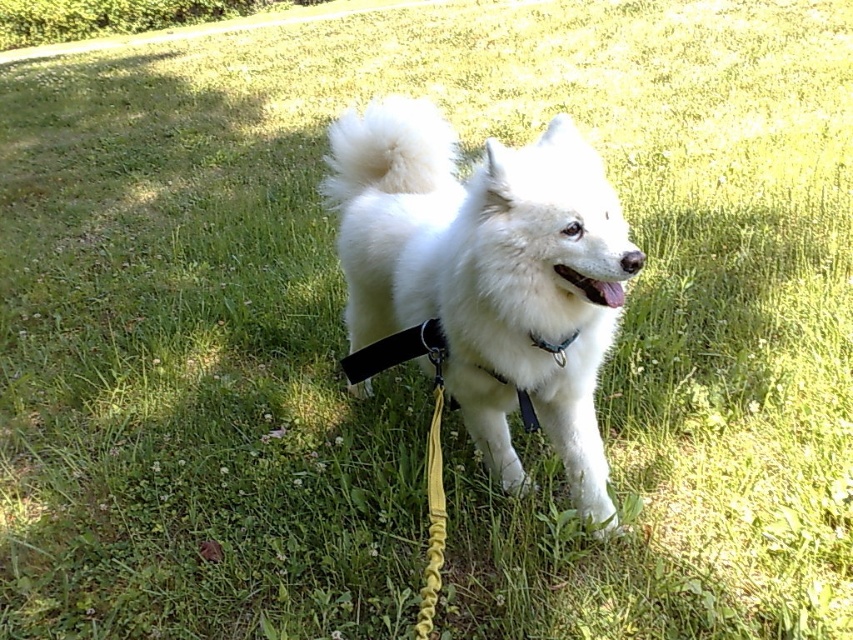
Question: Among these objects, which one is farthest from the camera?

Choices:
 (A) white fluffy dog at center
 (B) black nylon strap at center
 (C) black plastic neckband at center

Answer: (B)

Question: Among these points, which one is farthest from the camera?

Choices:
 (A) (532, 416)
 (B) (392, 262)
 (C) (564, 362)

Answer: (B)

Question: Considering the real-world distances, which object is closest to the black nylon strap at center?

Choices:
 (A) black plastic neckband at center
 (B) white fluffy dog at center

Answer: (B)

Question: From the image, what is the correct spatial relationship of white fluffy dog at center in relation to black plastic neckband at center?

Choices:
 (A) above
 (B) below

Answer: (A)

Question: Can you confirm if white fluffy dog at center is bigger than black plastic neckband at center?

Choices:
 (A) no
 (B) yes

Answer: (B)

Question: Does white fluffy dog at center have a lesser width compared to black plastic neckband at center?

Choices:
 (A) no
 (B) yes

Answer: (A)